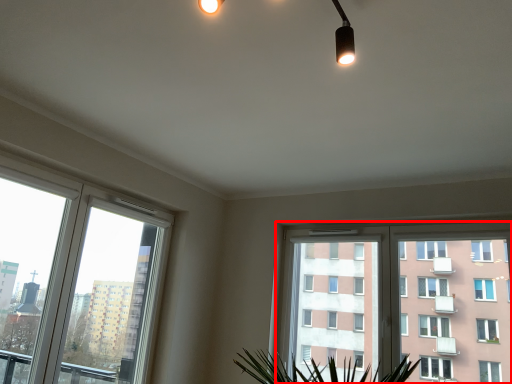
Question: Where is window (annotated by the red box) located in relation to window in the image?

Choices:
 (A) right
 (B) left

Answer: (A)